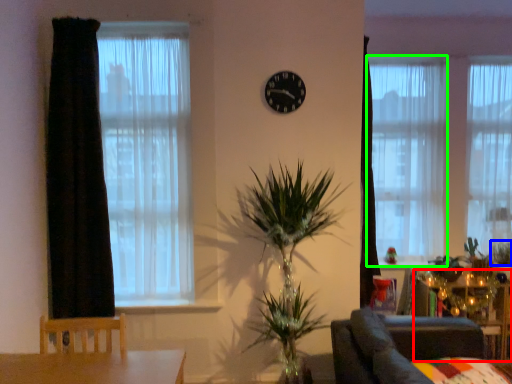
Question: Estimate the real-world distances between objects in this image. Which object is farther from side table (highlighted by a red box), plant (highlighted by a blue box) or curtain (highlighted by a green box)?

Choices:
 (A) plant
 (B) curtain

Answer: (B)